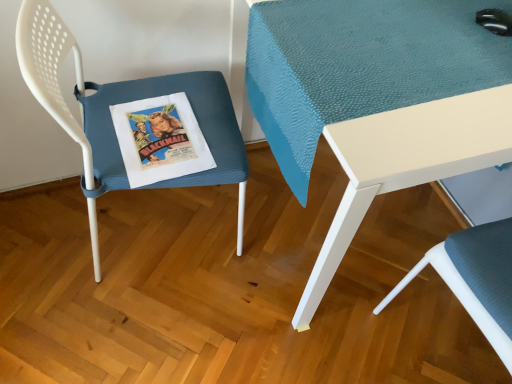
The height and width of the screenshot is (384, 512). What are the coordinates of `free space to the left of blue textured cushion at left, which appears as the 2th chair when viewed from the right` in the screenshot? It's located at (44, 244).